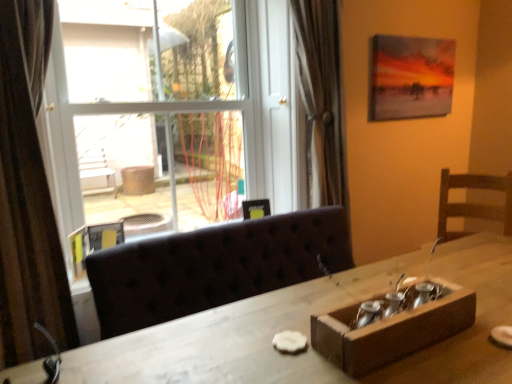
Question: Is matte canvas painting at upper right, arranged as the first picture frame when viewed from the right, to the right of transparent glass window at upper left from the viewer's perspective?

Choices:
 (A) no
 (B) yes

Answer: (B)

Question: Is matte canvas painting at upper right, arranged as the first picture frame when viewed from the right, turned away from transparent glass window at upper left?

Choices:
 (A) yes
 (B) no

Answer: (B)

Question: Is matte canvas painting at upper right, which appears as the 2th picture frame when viewed from the left, not close to transparent glass window at upper left?

Choices:
 (A) yes
 (B) no

Answer: (B)

Question: Is matte canvas painting at upper right, which appears as the 2th picture frame when viewed from the left, wider than transparent glass window at upper left?

Choices:
 (A) yes
 (B) no

Answer: (B)

Question: Does matte canvas painting at upper right, arranged as the first picture frame when viewed from the right, have a larger size compared to transparent glass window at upper left?

Choices:
 (A) no
 (B) yes

Answer: (A)

Question: Is matte canvas painting at upper right, arranged as the first picture frame when viewed from the right, taller or shorter than wooden box at lower right?

Choices:
 (A) short
 (B) tall

Answer: (B)

Question: Is matte canvas painting at upper right, the 2th picture frame from the front, wider or thinner than wooden box at lower right?

Choices:
 (A) thin
 (B) wide

Answer: (A)

Question: Looking at the image, does matte canvas painting at upper right, the first picture frame from the back, seem bigger or smaller compared to wooden box at lower right?

Choices:
 (A) big
 (B) small

Answer: (A)

Question: From the image's perspective, is matte canvas painting at upper right, arranged as the first picture frame when viewed from the right, positioned above or below wooden box at lower right?

Choices:
 (A) above
 (B) below

Answer: (A)

Question: Relative to wooden table at center, is matte canvas painting at upper right, the 1th picture frame positioned from the top, in front or behind?

Choices:
 (A) behind
 (B) front

Answer: (A)

Question: Does point [x=386, y=67] appear closer or farther from the camera than point [x=394, y=367]?

Choices:
 (A) farther
 (B) closer

Answer: (A)

Question: Is matte canvas painting at upper right, which appears as the 2th picture frame when viewed from the left, inside or outside of wooden table at center?

Choices:
 (A) inside
 (B) outside

Answer: (B)

Question: From the image's perspective, is matte canvas painting at upper right, which appears as the 2th picture frame when viewed from the left, above or below wooden table at center?

Choices:
 (A) above
 (B) below

Answer: (A)

Question: Considering their positions, is transparent glass window at upper left located in front of or behind matte canvas painting at upper right, the 1th picture frame positioned from the top?

Choices:
 (A) front
 (B) behind

Answer: (A)

Question: In terms of width, does transparent glass window at upper left look wider or thinner when compared to matte canvas painting at upper right, the 2th picture frame from the front?

Choices:
 (A) wide
 (B) thin

Answer: (A)